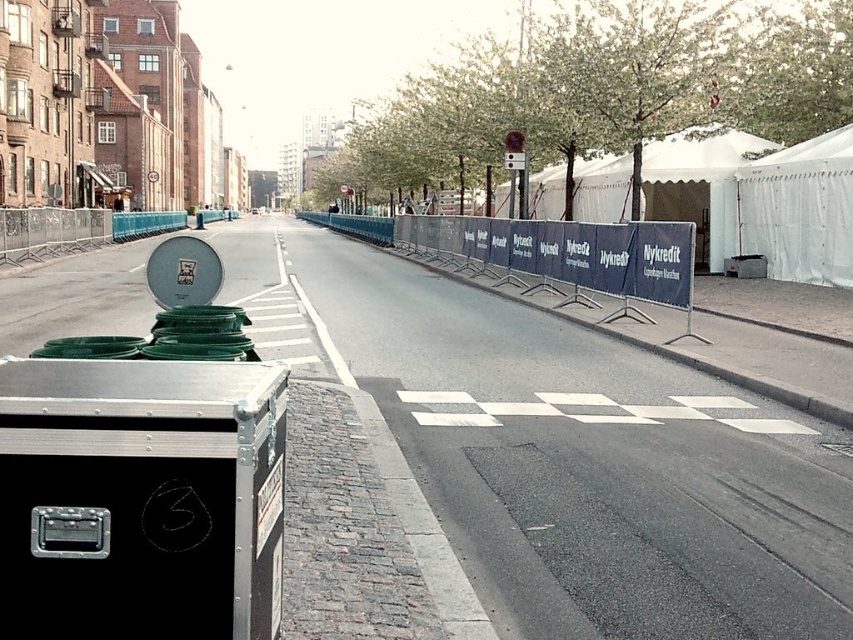
Which of these two, blue fabric barrier at center or white fabric tent at right, stands shorter?

Standing shorter between the two is white fabric tent at right.

Is blue fabric barrier at center closer to the viewer compared to white fabric tent at right?

Yes, blue fabric barrier at center is in front of white fabric tent at right.

In order to click on blue fabric barrier at center in this screenshot , I will do `click(548, 256)`.

Can you confirm if blue fabric barrier at center is positioned to the left of white fabric tent at center-right?

Indeed, blue fabric barrier at center is positioned on the left side of white fabric tent at center-right.

Can you confirm if blue fabric barrier at center is positioned to the right of white fabric tent at center-right?

No, blue fabric barrier at center is not to the right of white fabric tent at center-right.

Which is behind, point (614, 225) or point (680, 205)?

The point (680, 205) is behind.

Where is `blue fabric barrier at center`? blue fabric barrier at center is located at coordinates (548, 256).

Is point (735, 156) positioned after point (801, 216)?

Yes, it is.

Can you confirm if white fabric tent at center-right is smaller than white fabric tent at right?

No, white fabric tent at center-right is not smaller than white fabric tent at right.

Who is more forward, (650, 198) or (782, 184)?

Point (782, 184) is more forward.

The height and width of the screenshot is (640, 853). In order to click on white fabric tent at center-right in this screenshot , I will do `click(699, 186)`.